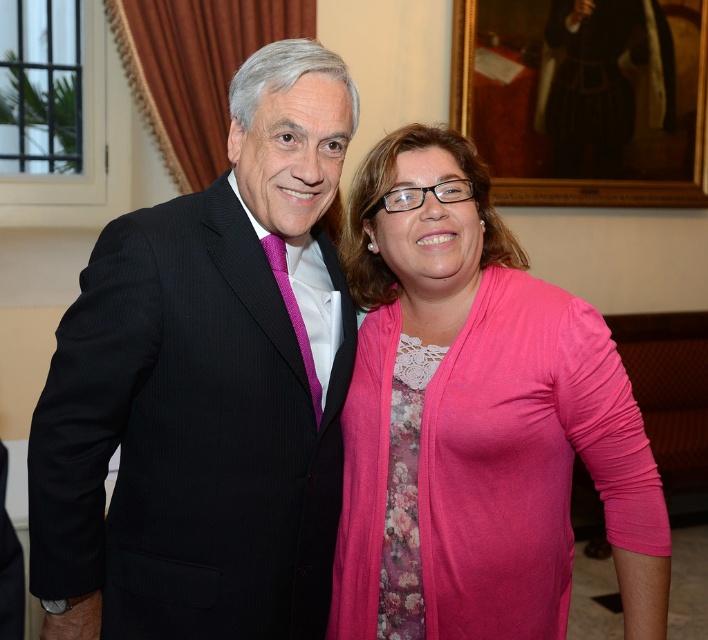
Question: Considering the real-world distances, which object is farthest from the purple textured tie at center?

Choices:
 (A) pink fabric shirt at center
 (B) wooden framed portrait at upper center
 (C) black pinstripe suit at center

Answer: (B)

Question: Is wooden framed portrait at upper center positioned at the back of purple textured tie at center?

Choices:
 (A) no
 (B) yes

Answer: (B)

Question: Considering the relative positions of black pinstripe suit at center and purple textured tie at center in the image provided, where is black pinstripe suit at center located with respect to purple textured tie at center?

Choices:
 (A) left
 (B) right

Answer: (A)

Question: Estimate the real-world distances between objects in this image. Which object is farther from the purple textured tie at center?

Choices:
 (A) wooden framed portrait at upper center
 (B) pink fabric shirt at center

Answer: (A)

Question: Can you confirm if black pinstripe suit at center is wider than purple textured tie at center?

Choices:
 (A) yes
 (B) no

Answer: (A)

Question: Considering the real-world distances, which object is closest to the black pinstripe suit at center?

Choices:
 (A) wooden framed portrait at upper center
 (B) purple textured tie at center
 (C) pink fabric shirt at center

Answer: (B)